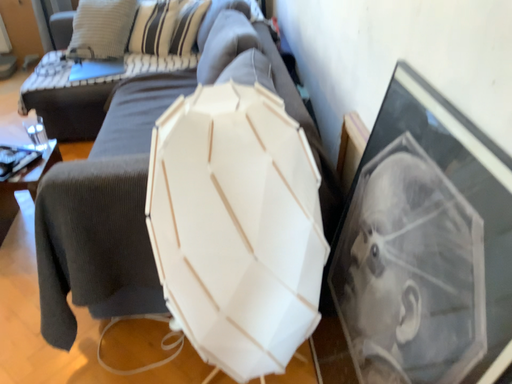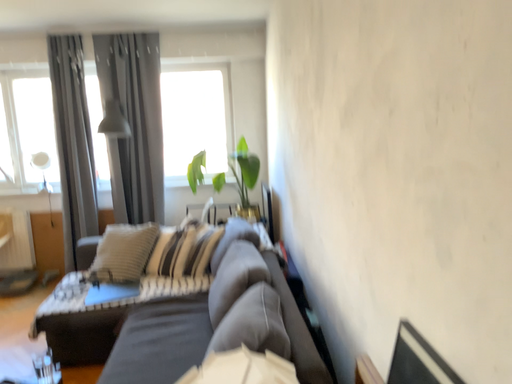
Question: Which way did the camera rotate in the video?

Choices:
 (A) rotated downward
 (B) rotated upward

Answer: (B)